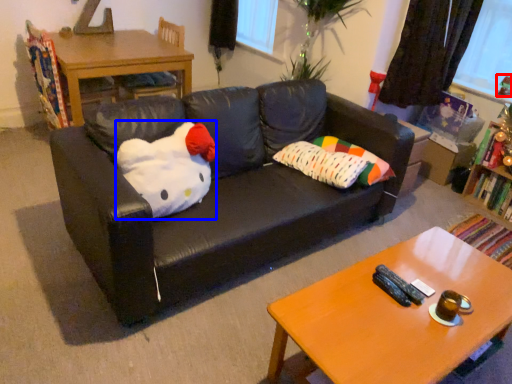
Question: Among these objects, which one is nearest to the camera, toy (highlighted by a red box) or animal (highlighted by a blue box)?

Choices:
 (A) toy
 (B) animal

Answer: (B)